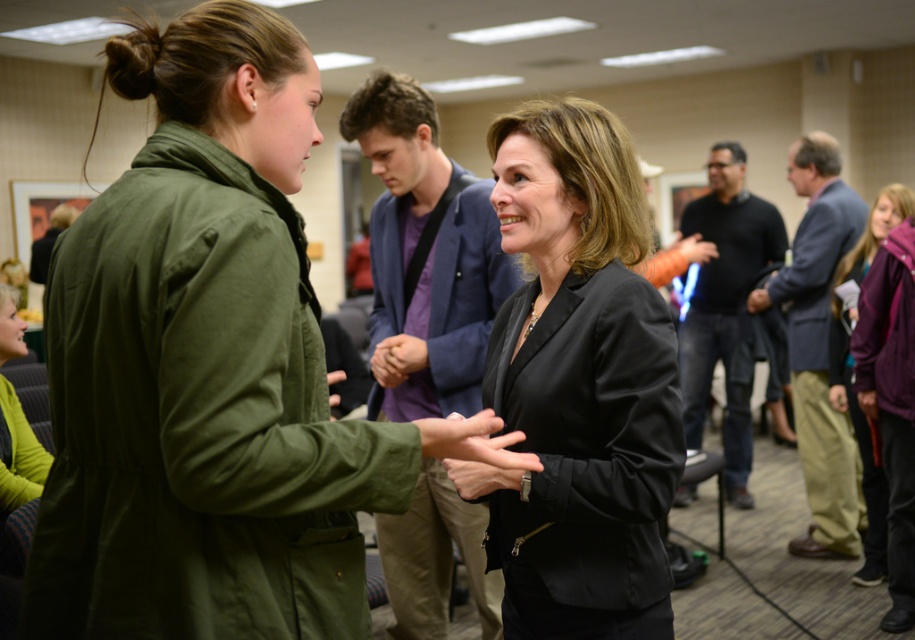
Between point (720, 163) and point (870, 426), which one is positioned behind?

The point (720, 163) is behind.

Is dark blue sweater at center bigger than purple fleece jacket at lower right?

Yes, dark blue sweater at center is bigger than purple fleece jacket at lower right.

Is point (711, 314) more distant than point (873, 552)?

That is True.

Where is `dark blue sweater at center`? dark blue sweater at center is located at coordinates (725, 305).

Measure the distance between point (802, 348) and camera.

A distance of 4.34 meters exists between point (802, 348) and camera.

Can you confirm if gray wool suit at right is wider than dark blue sweater at center?

Incorrect, gray wool suit at right's width does not surpass dark blue sweater at center's.

Is point (820, 401) in front of point (712, 173)?

That is True.

Locate an element on the screen. gray wool suit at right is located at coordinates (817, 346).

Based on the photo, is matte green jacket at center above dark blue sweater at center?

No, matte green jacket at center is not above dark blue sweater at center.

Where is `matte green jacket at center`? matte green jacket at center is located at coordinates (210, 369).

I want to click on matte green jacket at center, so click(x=210, y=369).